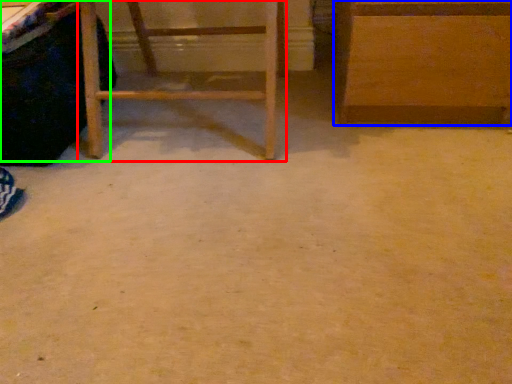
Question: Which object is positioned farthest from furniture (highlighted by a red box)? Select from furniture (highlighted by a blue box) and vanity (highlighted by a green box).

Choices:
 (A) furniture
 (B) vanity

Answer: (A)